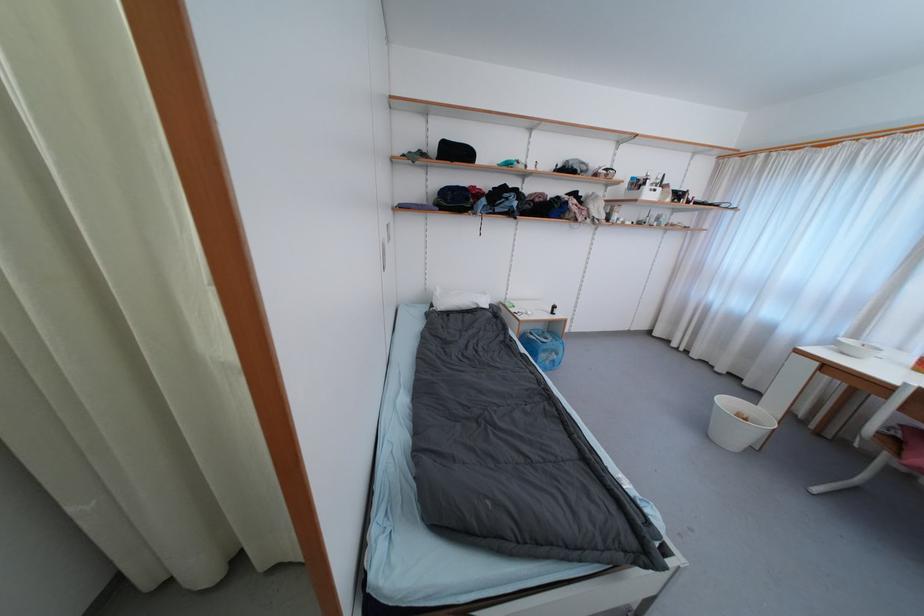
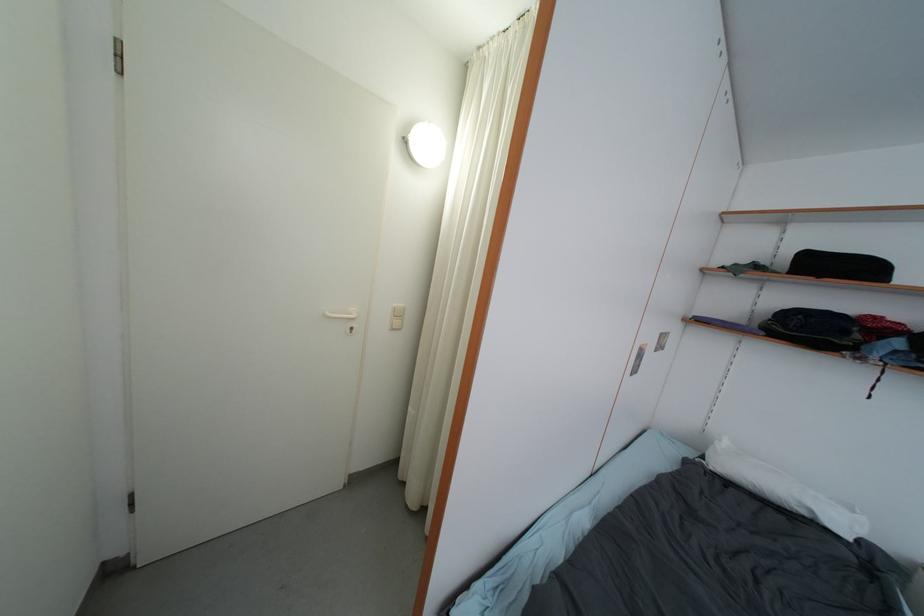
Question: The camera is either moving clockwise (left) or counter-clockwise (right) around the object. The first image is from the beginning of the video and the second image is from the end. Is the camera moving left or right when shooting the video?

Choices:
 (A) Left
 (B) Right

Answer: (B)